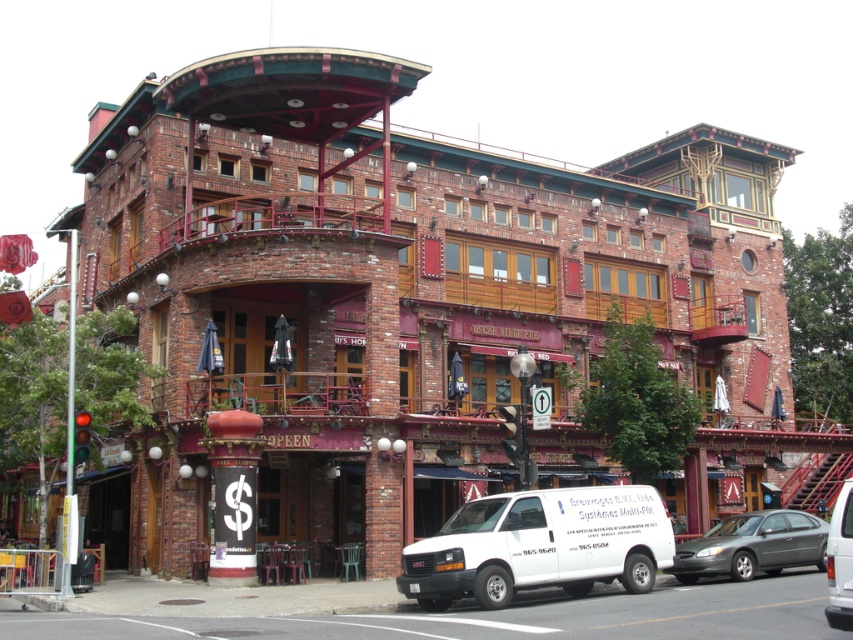
Question: Is white matte van at lower center in front of metallic gray sedan at lower right?

Choices:
 (A) no
 (B) yes

Answer: (B)

Question: Is white matte van at lower center positioned at the back of white matte van at center?

Choices:
 (A) no
 (B) yes

Answer: (B)

Question: Does white matte van at lower center have a greater width compared to metallic gray sedan at lower right?

Choices:
 (A) yes
 (B) no

Answer: (A)

Question: Which point appears closest to the camera in this image?

Choices:
 (A) (672, 566)
 (B) (553, 556)
 (C) (836, 502)

Answer: (C)

Question: Which point is farther to the camera?

Choices:
 (A) (834, 586)
 (B) (532, 536)
 (C) (715, 550)

Answer: (C)

Question: Which object is farther from the camera taking this photo?

Choices:
 (A) white matte van at lower center
 (B) white matte van at center

Answer: (A)